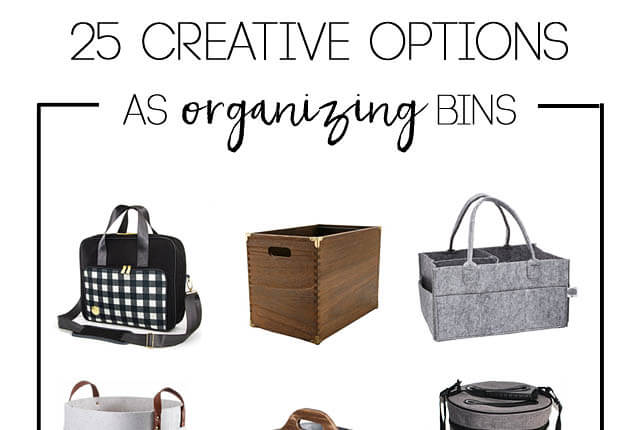
This screenshot has height=430, width=640. I want to click on wooden box, so click(308, 275).